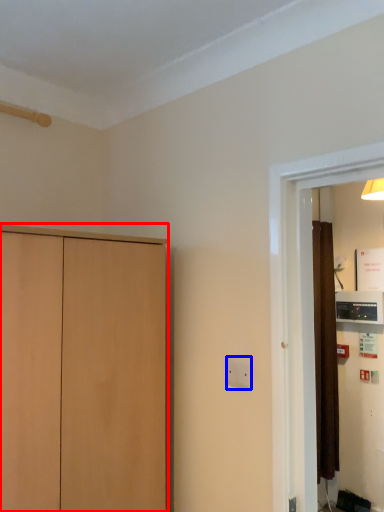
Question: Which of the following is the closest to the observer, cupboard (highlighted by a red box) or electric outlet (highlighted by a blue box)?

Choices:
 (A) cupboard
 (B) electric outlet

Answer: (A)